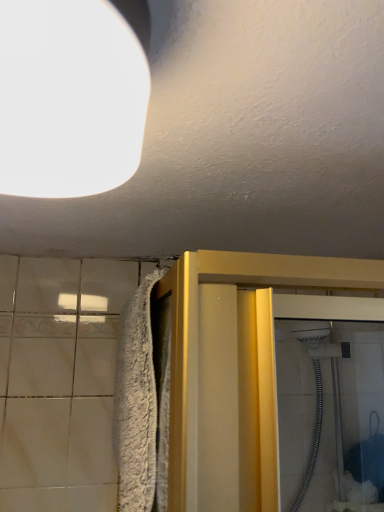
Question: Is white fluffy bath towel at left to the left or to the right of white matte light fixture at upper left in the image?

Choices:
 (A) left
 (B) right

Answer: (B)

Question: Considering the positions of white fluffy bath towel at left and white matte light fixture at upper left in the image, is white fluffy bath towel at left bigger or smaller than white matte light fixture at upper left?

Choices:
 (A) small
 (B) big

Answer: (B)

Question: In the image, is white fluffy bath towel at left positioned in front of or behind white matte light fixture at upper left?

Choices:
 (A) front
 (B) behind

Answer: (B)

Question: Is white matte light fixture at upper left in front of or behind white fluffy bath towel at left in the image?

Choices:
 (A) behind
 (B) front

Answer: (B)

Question: Considering the positions of point (59, 146) and point (167, 375), is point (59, 146) closer or farther from the camera than point (167, 375)?

Choices:
 (A) farther
 (B) closer

Answer: (B)

Question: Is white matte light fixture at upper left taller or shorter than white fluffy bath towel at left?

Choices:
 (A) tall
 (B) short

Answer: (B)

Question: From the image's perspective, relative to white fluffy bath towel at left, is white matte light fixture at upper left above or below?

Choices:
 (A) below
 (B) above

Answer: (B)